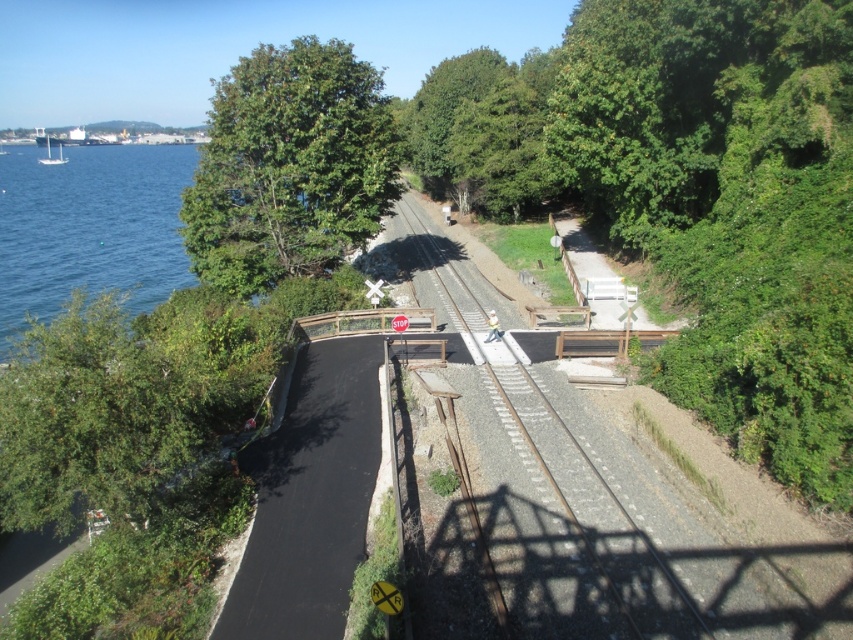
You are standing at the point marked by the coordinates point (x=547, y=476). What object is located exactly at this point?

The point (x=547, y=476) corresponds to the smooth metal train track at center.

You are driving a car and approaching the railway crossing. You see the smooth metal train track at center and the green leafy tree at upper left. Which object is closer to the road surface?

The smooth metal train track at center is closer to the road surface because it is shorter than the green leafy tree at upper left.

Based on the photo, you are a delivery driver approaching the railway crossing. Your truck is 2 meters wide. The smooth metal train track at center and the green leafy tree at upper left are in your path. Can your truck safely pass through the space between the two objects?

The smooth metal train track at center is narrower than the green leafy tree at upper left. However, the question is about the space between them. Since the track is at center and the tree is at upper left, their positions might not directly affect the truck passing through. The truck is 2 meters wide, but without knowing the actual width of the track or the distance between the objects, it is impossible to determine if the truck can safely pass. The given information only compares their widths, not the gap